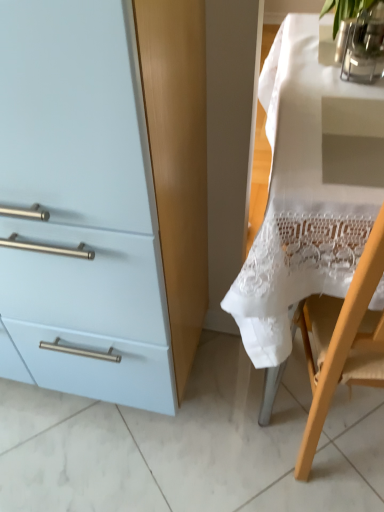
Question: Considering the positions of point (349, 48) and point (71, 99), is point (349, 48) closer or farther from the camera than point (71, 99)?

Choices:
 (A) farther
 (B) closer

Answer: (A)

Question: From a real-world perspective, is clear glass vase at upper right, which is counted as the 1th glass vase, starting from the front, physically located above or below light blue matte cabinet at left?

Choices:
 (A) below
 (B) above

Answer: (B)

Question: Based on their relative distances, which object is nearer to the clear glass vase at upper right, the second glass vase positioned from the back?

Choices:
 (A) white lace tablecloth at right
 (B) light blue matte cabinet at left
 (C) clear glass vase at upper right, marked as the first glass vase in a back-to-front arrangement

Answer: (C)

Question: Estimate the real-world distances between objects in this image. Which object is farther from the clear glass vase at upper right, the second glass vase positioned from the back?

Choices:
 (A) light blue matte cabinet at left
 (B) white lace tablecloth at right
 (C) clear glass vase at upper right, marked as the first glass vase in a back-to-front arrangement

Answer: (A)